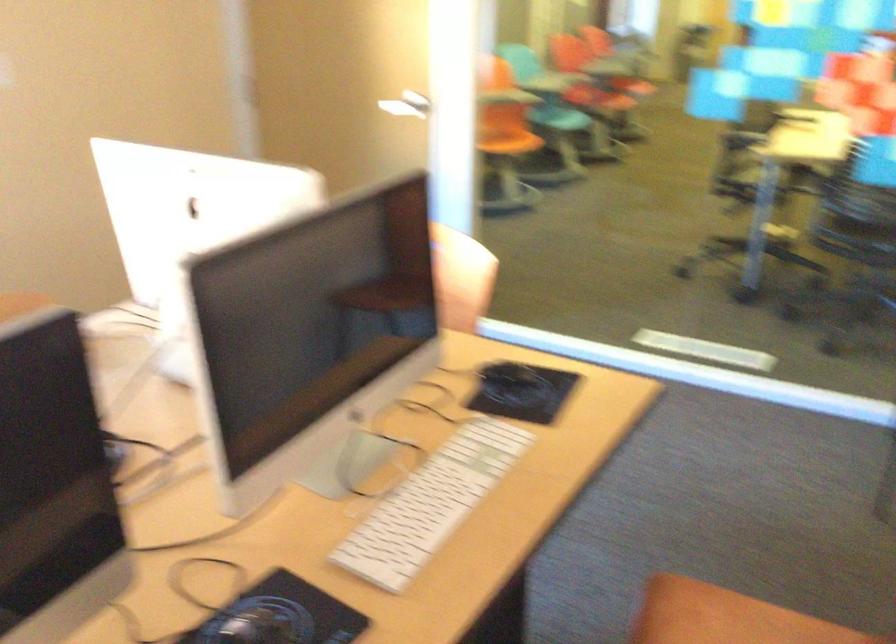
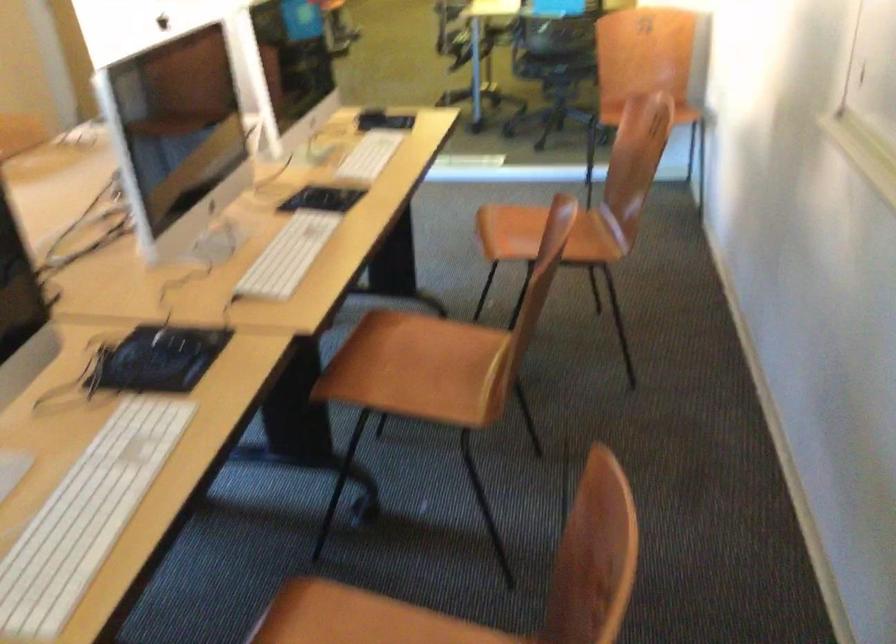
Based on the photo, in a continuous first-person perspective shot, in which direction is the camera moving?

The cameraman walked toward left, backward.